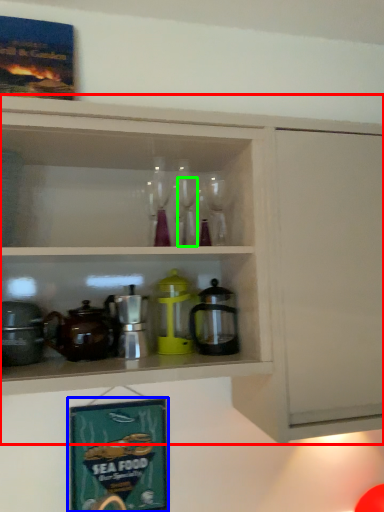
Question: Estimate the real-world distances between objects in this image. Which object is closer to cabinetry (highlighted by a red box), picture frame (highlighted by a blue box) or wine glass (highlighted by a green box)?

Choices:
 (A) picture frame
 (B) wine glass

Answer: (B)